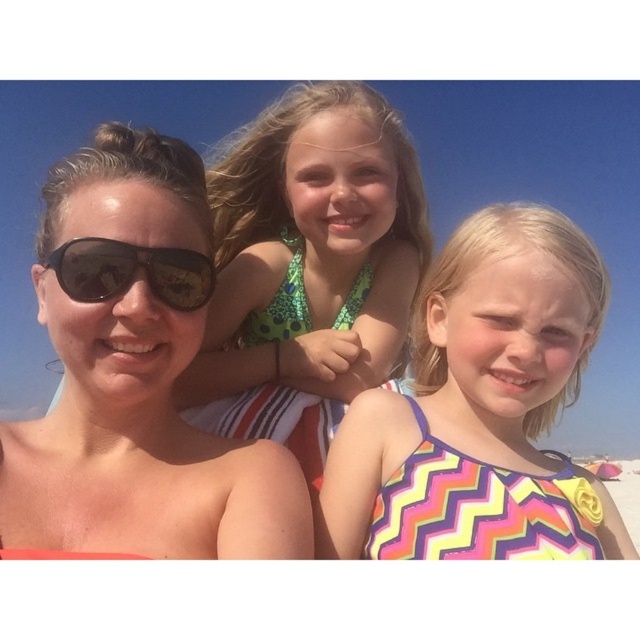
Question: Can you confirm if matte black sunglasses at left is thinner than black reflective sunglasses at left?

Choices:
 (A) no
 (B) yes

Answer: (A)

Question: Which point is closer to the camera?

Choices:
 (A) green polka dot swimsuit at center
 (B) black reflective sunglasses at left
 (C) multicolored zigzag swimsuit at center

Answer: (B)

Question: Which point is farther from the camera taking this photo?

Choices:
 (A) pyautogui.click(x=525, y=376)
 (B) pyautogui.click(x=412, y=296)
 (C) pyautogui.click(x=168, y=148)
 (D) pyautogui.click(x=176, y=256)

Answer: (B)

Question: Can you confirm if green polka dot swimsuit at center is bigger than black reflective sunglasses at left?

Choices:
 (A) no
 (B) yes

Answer: (B)

Question: Can you confirm if matte black sunglasses at left is bigger than black reflective sunglasses at left?

Choices:
 (A) yes
 (B) no

Answer: (A)

Question: Which object is farther from the camera taking this photo?

Choices:
 (A) black reflective sunglasses at left
 (B) green polka dot swimsuit at center
 (C) multicolored zigzag swimsuit at center
 (D) matte black sunglasses at left

Answer: (B)